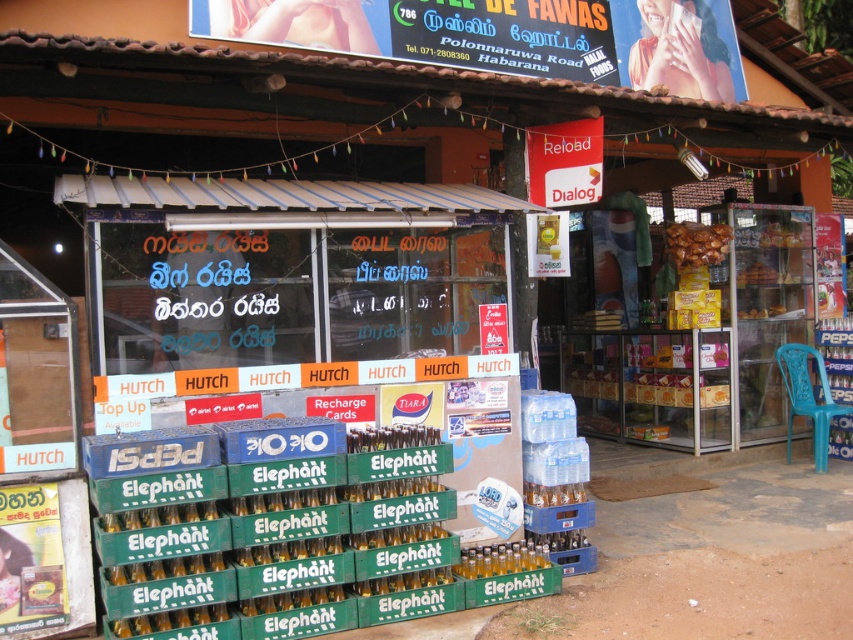
Question: Can you confirm if blue plastic chair at right is positioned above golden crispy snack at right?

Choices:
 (A) no
 (B) yes

Answer: (A)

Question: Is black plastic signboard at upper center to the left of golden crispy snack at right from the viewer's perspective?

Choices:
 (A) yes
 (B) no

Answer: (A)

Question: Which object is the farthest from the white paper sign at upper center?

Choices:
 (A) golden crispy snack at right
 (B) black plastic signboard at upper center

Answer: (A)

Question: Which point is farther to the camera?

Choices:
 (A) brown crispy snack at right
 (B) blue plastic chair at right
 (C) golden crispy snack at right
 (D) white paper sign at upper center

Answer: (C)

Question: Is blue plastic chair at right to the left of golden crispy snack at right from the viewer's perspective?

Choices:
 (A) yes
 (B) no

Answer: (B)

Question: Among these points, which one is nearest to the camera?

Choices:
 (A) (581, 20)
 (B) (785, 385)
 (C) (585, 136)

Answer: (C)